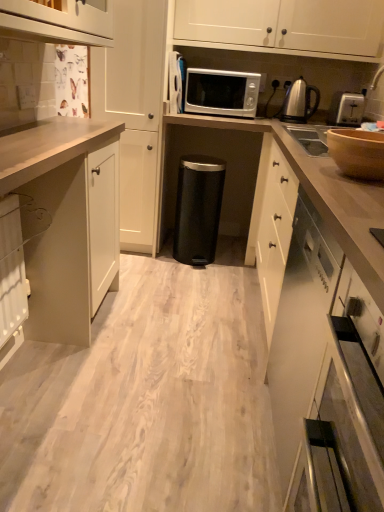
Question: Is white matte cabinet at upper center, acting as the 1th cabinetry starting from the back, behind black matte trash can at center?

Choices:
 (A) yes
 (B) no

Answer: (B)

Question: Is black matte trash can at center at the back of white matte cabinet at upper center, acting as the 1th cabinetry starting from the back?

Choices:
 (A) yes
 (B) no

Answer: (B)

Question: Does white matte cabinet at upper center, which is the 4th cabinetry from front to back, have a greater width compared to black matte trash can at center?

Choices:
 (A) yes
 (B) no

Answer: (B)

Question: Is white matte cabinet at upper center, which is the 4th cabinetry from front to back, far away from black matte trash can at center?

Choices:
 (A) no
 (B) yes

Answer: (A)

Question: Can you confirm if white matte cabinet at upper center, acting as the 1th cabinetry starting from the back, is positioned to the left of black matte trash can at center?

Choices:
 (A) yes
 (B) no

Answer: (B)

Question: Considering the relative sizes of white matte cabinet at upper center, which is the 4th cabinetry from front to back, and black matte trash can at center in the image provided, is white matte cabinet at upper center, which is the 4th cabinetry from front to back, bigger than black matte trash can at center?

Choices:
 (A) yes
 (B) no

Answer: (A)

Question: Can you confirm if white matte cabinet at lower right, acting as the fourth cabinetry starting from the back, is wider than black matte trash can at center?

Choices:
 (A) no
 (B) yes

Answer: (A)

Question: Could you tell me if white matte cabinet at lower right, which appears as the first cabinetry when viewed from the front, is turned towards black matte trash can at center?

Choices:
 (A) yes
 (B) no

Answer: (B)

Question: Is white matte cabinet at lower right, acting as the fourth cabinetry starting from the back, in front of black matte trash can at center?

Choices:
 (A) no
 (B) yes

Answer: (B)

Question: Is white matte cabinet at lower right, which appears as the first cabinetry when viewed from the front, to the right of black matte trash can at center from the viewer's perspective?

Choices:
 (A) no
 (B) yes

Answer: (B)

Question: Is white matte cabinet at lower right, acting as the fourth cabinetry starting from the back, outside black matte trash can at center?

Choices:
 (A) no
 (B) yes

Answer: (B)

Question: Does white matte cabinet at lower right, acting as the fourth cabinetry starting from the back, have a lesser width compared to black matte trash can at center?

Choices:
 (A) no
 (B) yes

Answer: (B)

Question: Is black matte trash can at center to the right of polished stainless steel kettle at upper right from the viewer's perspective?

Choices:
 (A) yes
 (B) no

Answer: (B)